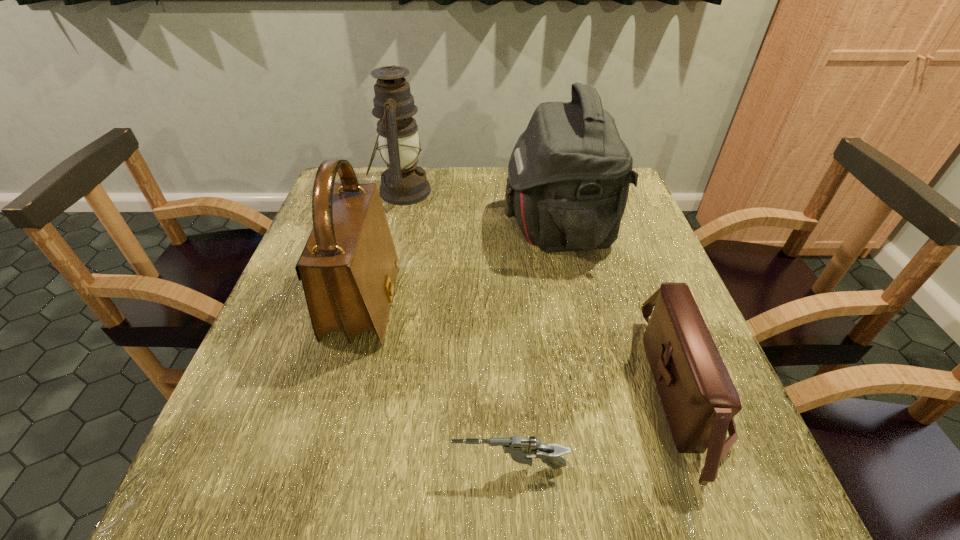
At what (x,y) coordinates should I click in order to perform the action: click on free spot located at the barrel of the gun. Please return your answer as a coordinate pair (x, y). Image resolution: width=960 pixels, height=540 pixels. Looking at the image, I should click on (307, 468).

Identify the location of free space located at the barrel of the gun. (212, 468).

Identify the location of oil lamp present at the far edge. The image size is (960, 540). (404, 183).

This screenshot has width=960, height=540. Find the location of `shoulder bag that is at the far edge`. shoulder bag that is at the far edge is located at coordinates (569, 173).

Where is `shoulder bag located at the near edge`? This screenshot has height=540, width=960. shoulder bag located at the near edge is located at coordinates coord(699,398).

This screenshot has width=960, height=540. I want to click on gun positioned at the near edge, so pyautogui.click(x=520, y=450).

Where is `oil lamp that is positioned at the left edge`? The image size is (960, 540). oil lamp that is positioned at the left edge is located at coordinates (404, 183).

What are the coordinates of `shoulder bag present at the left edge` in the screenshot? It's located at (348, 268).

Locate an element on the screen. object present at the far left corner is located at coordinates (404, 183).

Locate an element on the screen. Image resolution: width=960 pixels, height=540 pixels. object present at the far right corner is located at coordinates (569, 173).